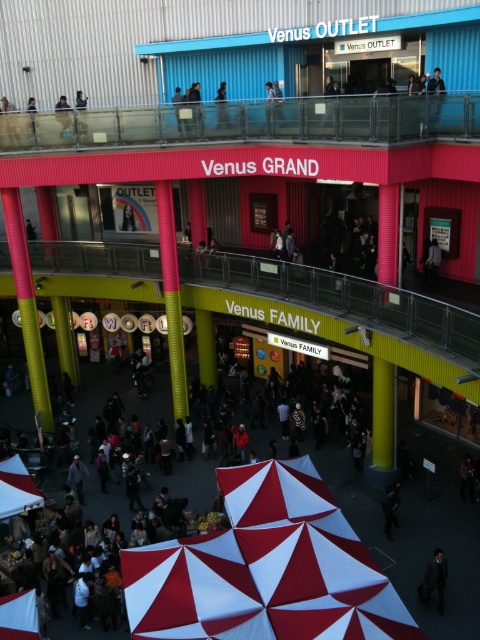
In the scene shown: Who is taller, red and white fabric canopy at center or dark gray suit at lower right?

dark gray suit at lower right is taller.

Is red and white fabric canopy at center thinner than dark gray suit at lower right?

Indeed, red and white fabric canopy at center has a lesser width compared to dark gray suit at lower right.

This screenshot has height=640, width=480. Find the location of `red and white fabric canopy at center`. red and white fabric canopy at center is located at coordinates (264, 576).